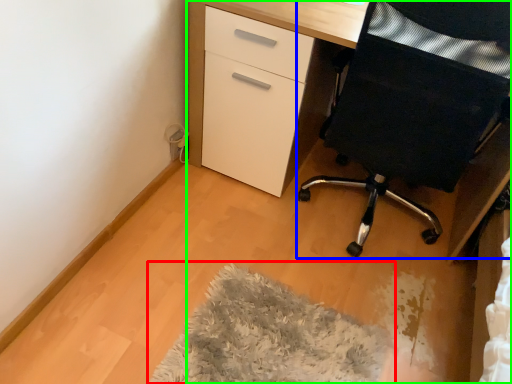
Question: Estimate the real-world distances between objects in this image. Which object is farther from mat (highlighted by a red box), furniture (highlighted by a blue box) or desk (highlighted by a green box)?

Choices:
 (A) furniture
 (B) desk

Answer: (B)